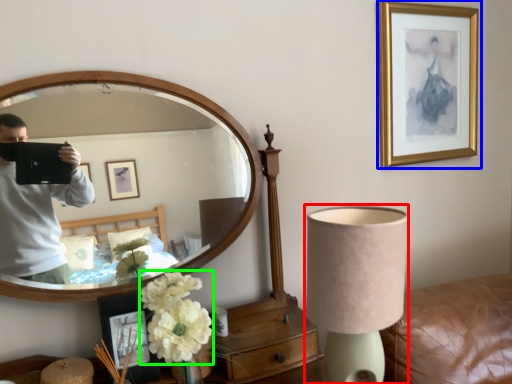
Question: Considering the real-world distances, which object is closest to lamp (highlighted by a red box)? picture frame (highlighted by a blue box) or flower (highlighted by a green box).

Choices:
 (A) picture frame
 (B) flower

Answer: (B)